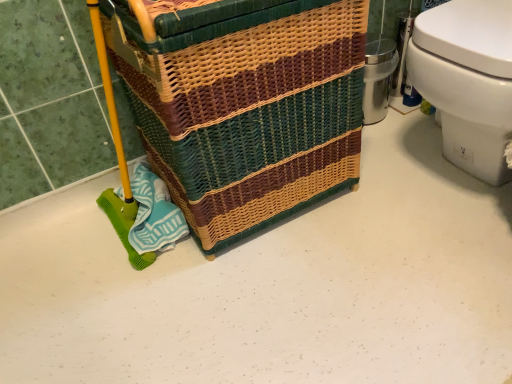
I want to click on woven wicker basket at center, so click(245, 106).

The width and height of the screenshot is (512, 384). What do you see at coordinates (245, 106) in the screenshot?
I see `woven wicker basket at center` at bounding box center [245, 106].

You are a GUI agent. You are given a task and a screenshot of the screen. Output one action in this format:
    pyautogui.click(x=<x>, y=<y>)
    Task: Click on the white glossy toilet at right
    The image size is (512, 384).
    Given the screenshot: What is the action you would take?
    pyautogui.click(x=468, y=81)

The height and width of the screenshot is (384, 512). What do you see at coordinates (468, 81) in the screenshot? I see `white glossy toilet at right` at bounding box center [468, 81].

Locate an element on the screen. This screenshot has height=384, width=512. woven wicker basket at center is located at coordinates (245, 106).

Which is more to the right, white glossy toilet at right or woven wicker basket at center?

Positioned to the right is white glossy toilet at right.

Which is in front, white glossy toilet at right or woven wicker basket at center?

woven wicker basket at center is more forward.

Between point (486, 118) and point (250, 143), which one is positioned in front?

The point (486, 118) is closer.

From the image's perspective, is white glossy toilet at right over woven wicker basket at center?

Correct, white glossy toilet at right appears higher than woven wicker basket at center in the image.

From a real-world perspective, between white glossy toilet at right and woven wicker basket at center, who is vertically lower?

white glossy toilet at right is physically lower.

Does white glossy toilet at right have a greater width compared to woven wicker basket at center?

Indeed, white glossy toilet at right has a greater width compared to woven wicker basket at center.

From their relative heights in the image, would you say white glossy toilet at right is taller or shorter than woven wicker basket at center?

In the image, white glossy toilet at right appears to be shorter than woven wicker basket at center.

Can you confirm if white glossy toilet at right is smaller than woven wicker basket at center?

Yes, white glossy toilet at right is smaller than woven wicker basket at center.

Is white glossy toilet at right positioned beyond the bounds of woven wicker basket at center?

Indeed, white glossy toilet at right is completely outside woven wicker basket at center.

Looking at this image, is white glossy toilet at right placed right next to woven wicker basket at center?

No, white glossy toilet at right is not beside woven wicker basket at center.

Is white glossy toilet at right oriented towards woven wicker basket at center?

No, white glossy toilet at right does not turn towards woven wicker basket at center.

How different are the orientations of white glossy toilet at right and woven wicker basket at center in degrees?

They differ by 89.2 degrees in their facing directions.

In the image, there is a white glossy toilet at right. Identify the location of basket container below it (from the image's perspective). (245, 106).

Considering the relative positions of woven wicker basket at center and white glossy toilet at right in the image provided, is woven wicker basket at center to the left of white glossy toilet at right from the viewer's perspective?

Indeed, woven wicker basket at center is positioned on the left side of white glossy toilet at right.

In the scene shown: Which is in front, woven wicker basket at center or white glossy toilet at right?

woven wicker basket at center is in front.

Is point (281, 190) positioned behind point (489, 99)?

Yes, point (281, 190) is behind point (489, 99).

From the image's perspective, which is below, woven wicker basket at center or white glossy toilet at right?

woven wicker basket at center, from the image's perspective.

From a real-world perspective, which is physically above, woven wicker basket at center or white glossy toilet at right?

woven wicker basket at center is physically above.

Considering the sizes of objects woven wicker basket at center and white glossy toilet at right in the image provided, who is wider, woven wicker basket at center or white glossy toilet at right?

white glossy toilet at right is wider.

Which of these two, woven wicker basket at center or white glossy toilet at right, stands taller?

Standing taller between the two is woven wicker basket at center.

Between woven wicker basket at center and white glossy toilet at right, which one has larger size?

Bigger between the two is woven wicker basket at center.

Is woven wicker basket at center not within white glossy toilet at right?

woven wicker basket at center lies outside white glossy toilet at right's area.

Can you see woven wicker basket at center touching white glossy toilet at right?

No, woven wicker basket at center is not beside white glossy toilet at right.

Is woven wicker basket at center facing towards white glossy toilet at right?

No, woven wicker basket at center is not aimed at white glossy toilet at right.

Where is `basket container that appears below the white glossy toilet at right (from the image's perspective)`? The height and width of the screenshot is (384, 512). basket container that appears below the white glossy toilet at right (from the image's perspective) is located at coordinates (245, 106).

Image resolution: width=512 pixels, height=384 pixels. Identify the location of toilet located underneath the woven wicker basket at center (from a real-world perspective). (468, 81).

Where is `basket container located in front of the white glossy toilet at right`? This screenshot has width=512, height=384. basket container located in front of the white glossy toilet at right is located at coordinates (245, 106).